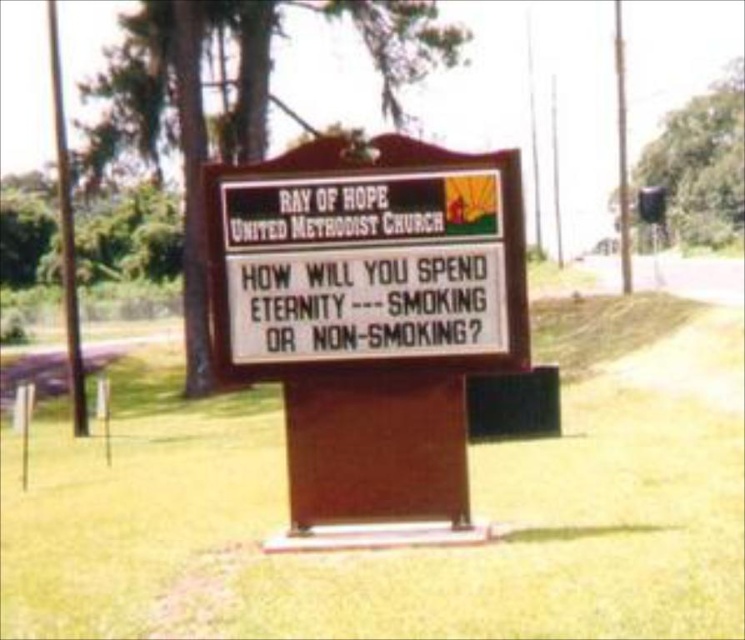
You are planning to place a small garden statue exactly in the middle between the green grass at center and the wooden signboard at center. Considering their widths, which object will have more space on either side of it after placement?

The green grass at center has a greater width than the wooden signboard at center, so placing the statue between them would leave more space on both sides of the green grass at center.